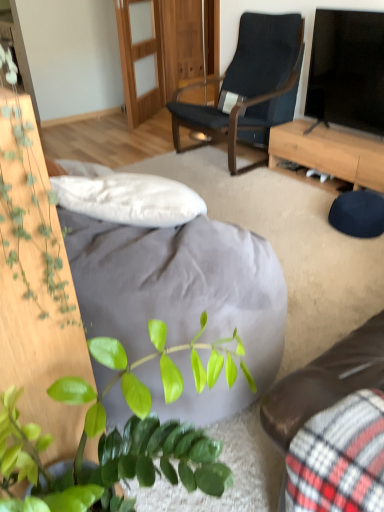
Image resolution: width=384 pixels, height=512 pixels. Find the location of `vacant area situated below black glossy tv at upper right (from a real-world perspective)`. vacant area situated below black glossy tv at upper right (from a real-world perspective) is located at coordinates (347, 136).